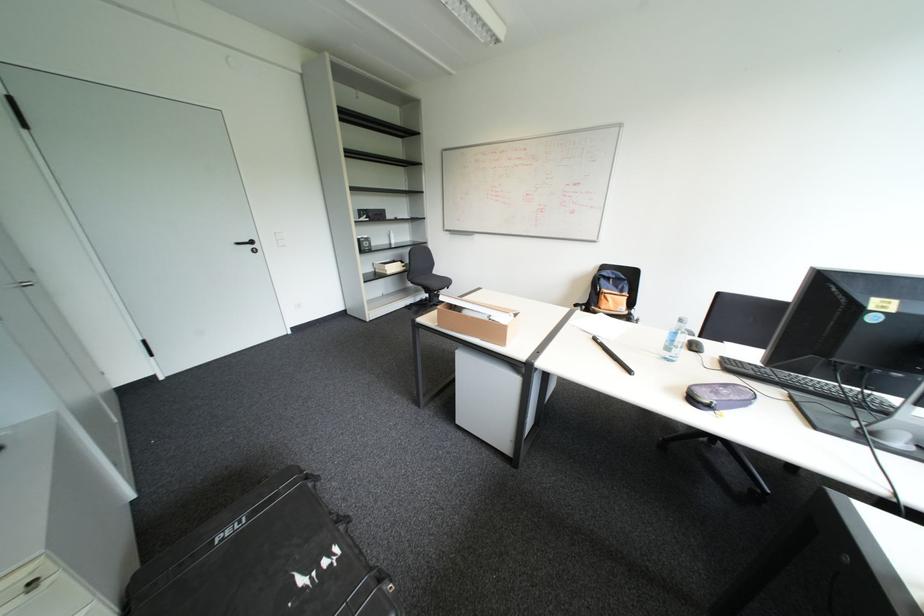
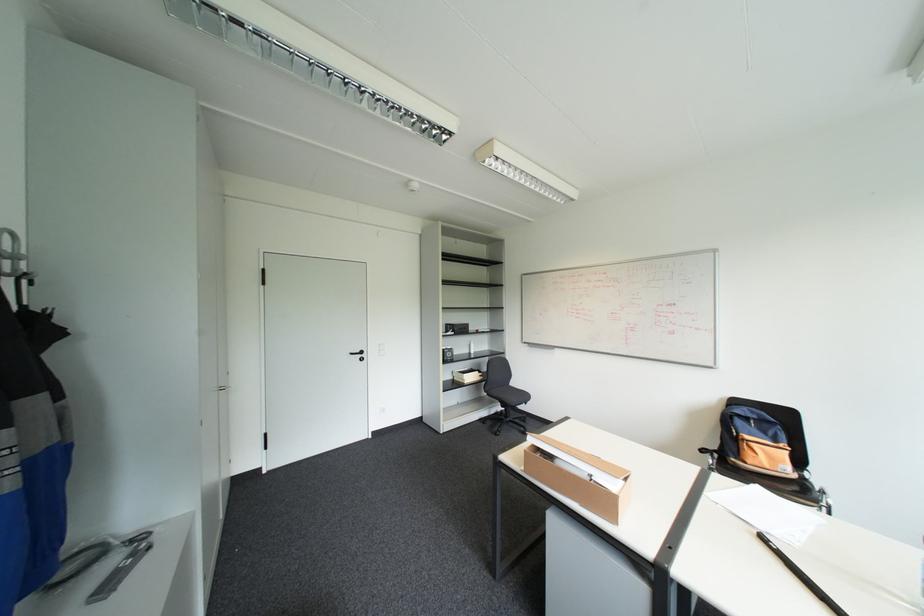
Locate, in the second image, the point that corresponds to the point at 472,307 in the first image.

(565, 455)